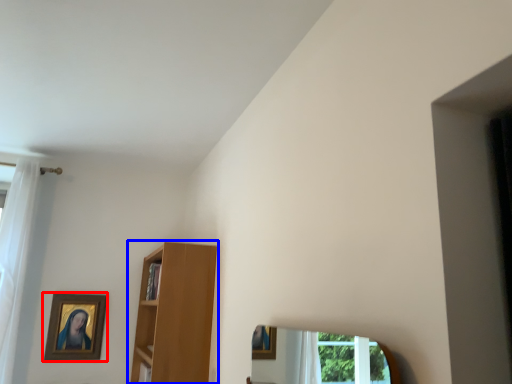
Question: Which object appears farthest to the camera in this image, picture frame (highlighted by a red box) or shelf (highlighted by a blue box)?

Choices:
 (A) picture frame
 (B) shelf

Answer: (A)